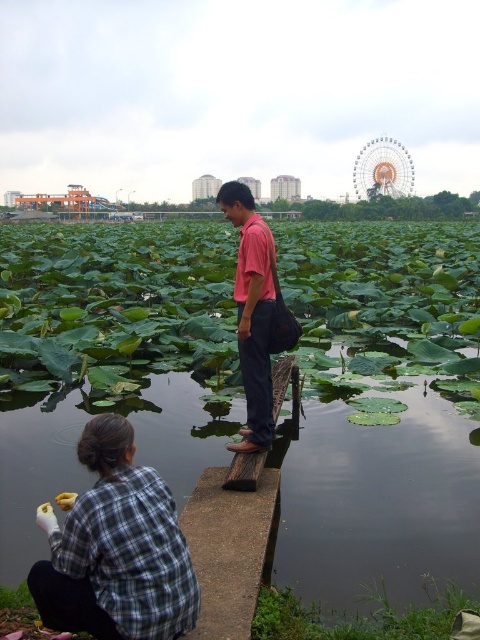
Is the position of plaid fabric shirt at lower left more distant than that of pink matte shirt at center?

No.

At what (x,y) coordinates should I click in order to perform the action: click on plaid fabric shirt at lower left. Please return your answer as a coordinate pair (x, y). Looking at the image, I should click on (116, 548).